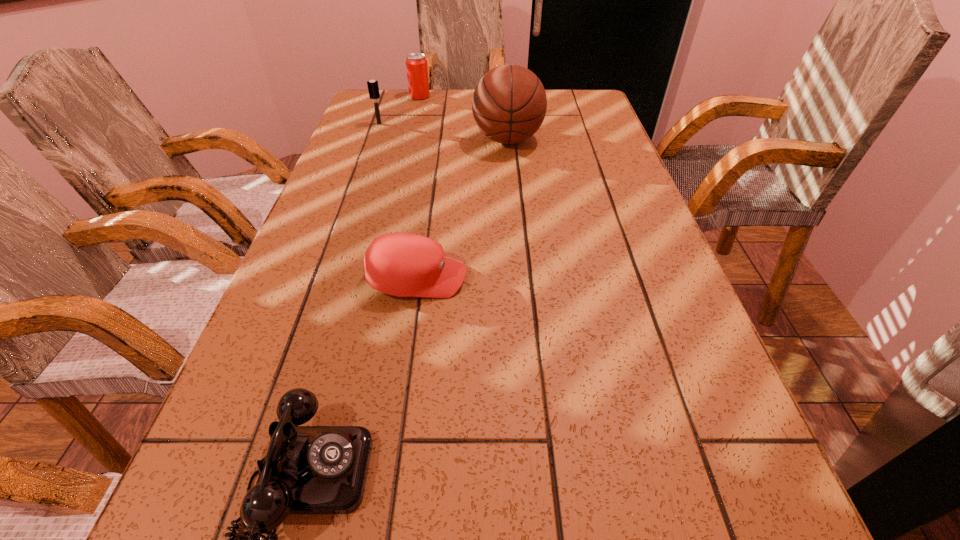
At what (x,y) coordinates should I click in order to perform the action: click on free space that is in between the hairbrush and the tallest object. Please return your answer as a coordinate pair (x, y). The height and width of the screenshot is (540, 960). Looking at the image, I should click on (444, 132).

Where is `free space between the tallest object and the cap`? This screenshot has width=960, height=540. free space between the tallest object and the cap is located at coordinates (463, 209).

Find the location of a particular element. The image size is (960, 540). empty space that is in between the can and the hairbrush is located at coordinates (399, 110).

The height and width of the screenshot is (540, 960). Find the location of `unoccupied area between the second nearest object and the hairbrush`. unoccupied area between the second nearest object and the hairbrush is located at coordinates (398, 201).

Image resolution: width=960 pixels, height=540 pixels. I want to click on empty space between the hairbrush and the can, so click(399, 110).

Locate an element on the screen. free space between the farthest object and the cap is located at coordinates (x=419, y=187).

Identify which object is located as the nearest to the tallest object. Please provide its 2D coordinates. Your answer should be formatted as a tuple, i.e. [(x, y)], where the tuple contains the x and y coordinates of a point satisfying the conditions above.

[(416, 64)]

Locate an element on the screen. object identified as the fourth closest to the second nearest object is located at coordinates pyautogui.click(x=416, y=64).